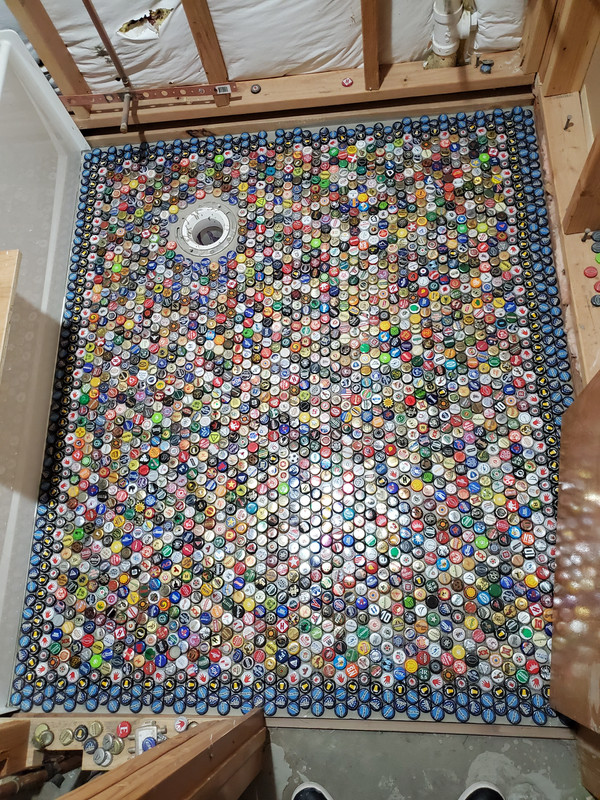
This screenshot has height=800, width=600. I want to click on baseboar, so click(61, 233), click(18, 577).